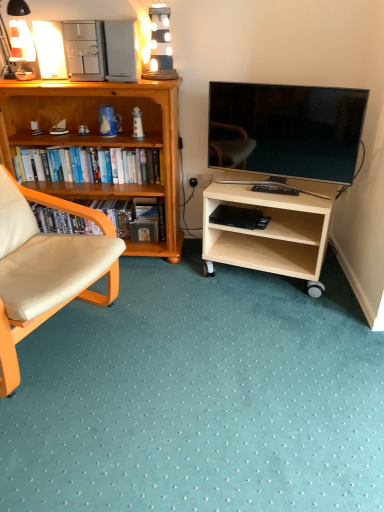
Where is `vacant area situated below matte black tv at right (from a real-world perspective)`? The height and width of the screenshot is (512, 384). vacant area situated below matte black tv at right (from a real-world perspective) is located at coordinates (292, 186).